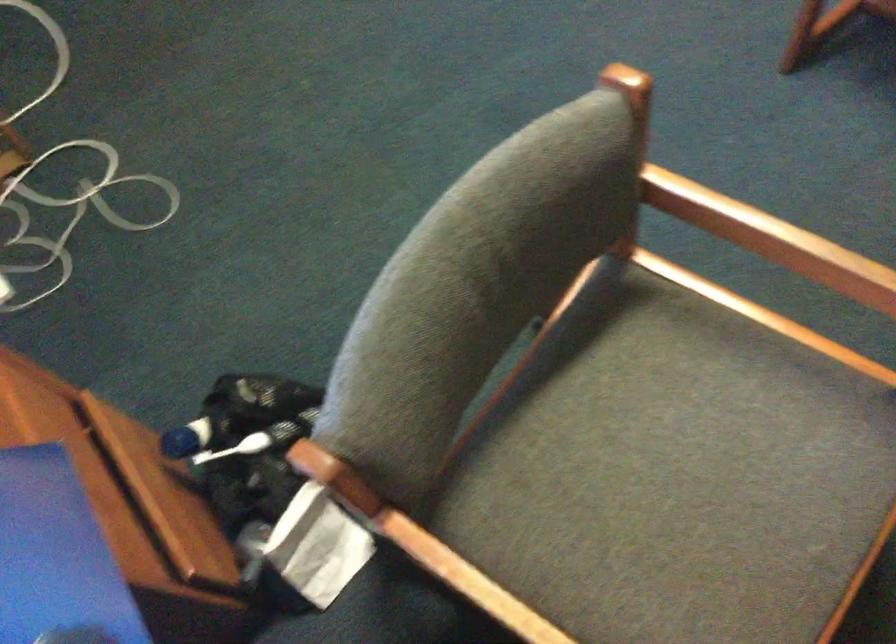
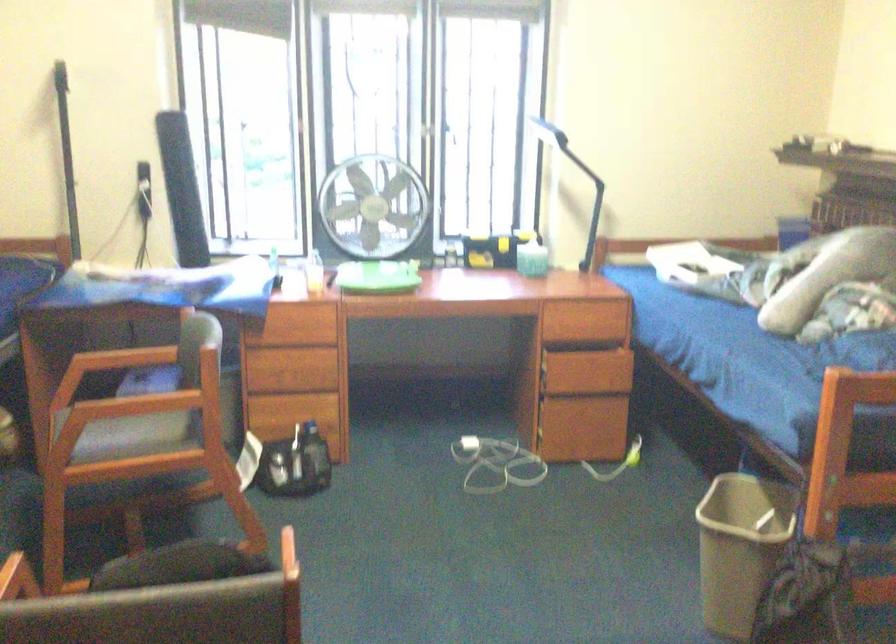
Find the pixel in the second image that matches point (261, 415) in the first image.

(314, 457)